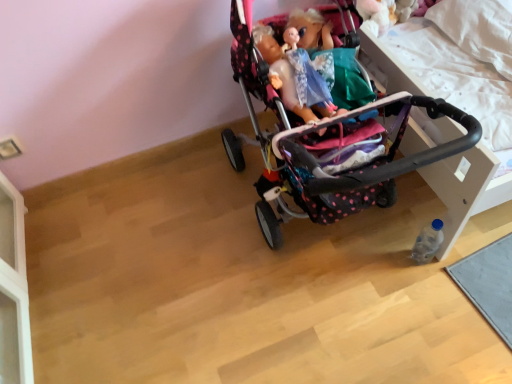
Image resolution: width=512 pixels, height=384 pixels. Find the location of `vacant region to the left of polka dot fabric stroller at center`. vacant region to the left of polka dot fabric stroller at center is located at coordinates (177, 250).